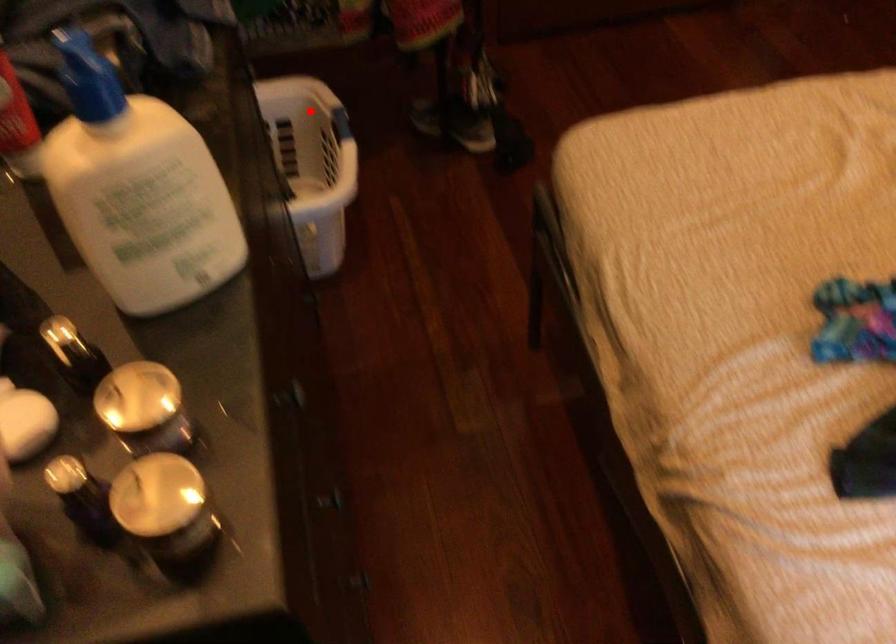
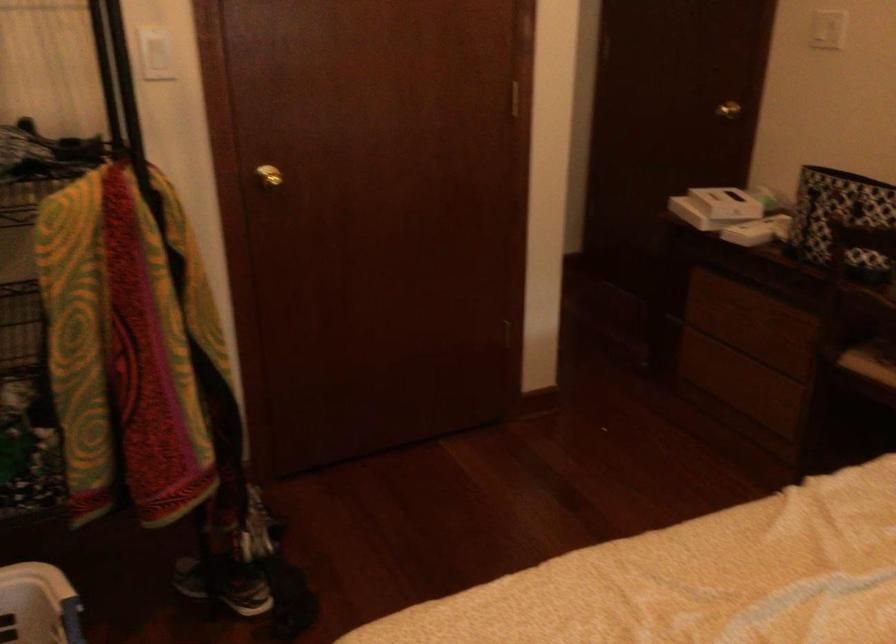
Find the pixel in the second image that matches the highlighted location in the first image.

(38, 605)